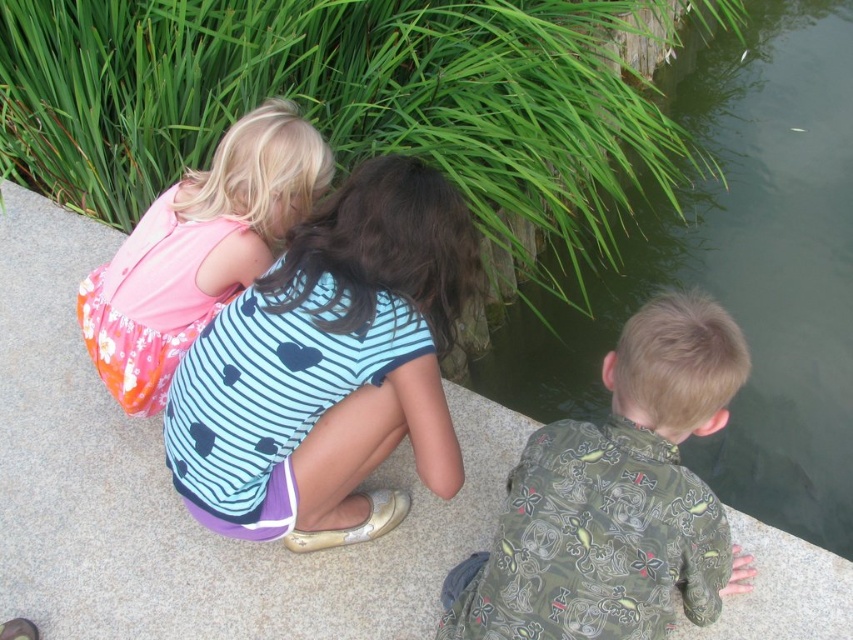
You are a photographer trying to capture a photo of the green stone pond at lower right without including the blue striped shirt at center in the frame. Based on their positions, is this possible?

The green stone pond at lower right is located above the blue striped shirt at center, so if you position the camera below the shirt, you can capture the pond without the shirt appearing in the frame.